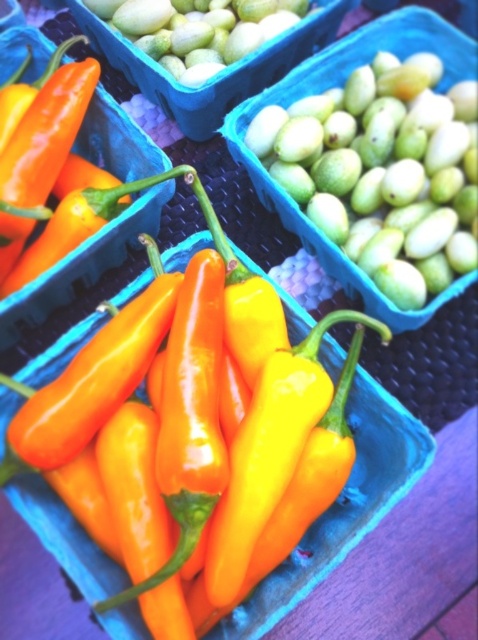
You are a customer at the market and want to choose the thicker melon between the green matte melon at upper right and the green matte melon at upper center. Which one should you pick?

The green matte melon at upper center is thicker than the green matte melon at upper right, so you should pick the green matte melon at upper center.

You are a customer at the market and want to locate the green matte melon at upper right. According to the coordinates provided, where exactly should you look on the image?

The green matte melon at upper right is located at coordinates point (x=372, y=179).

You are a customer at the market and want to pick up the green matte melon at upper right. Which melon should you pick up first if you want to reach it without moving the green matte melon at upper center?

The green matte melon at upper right is located below the green matte melon at upper center, so you should pick up the green matte melon at upper center first to access the one below without moving it.